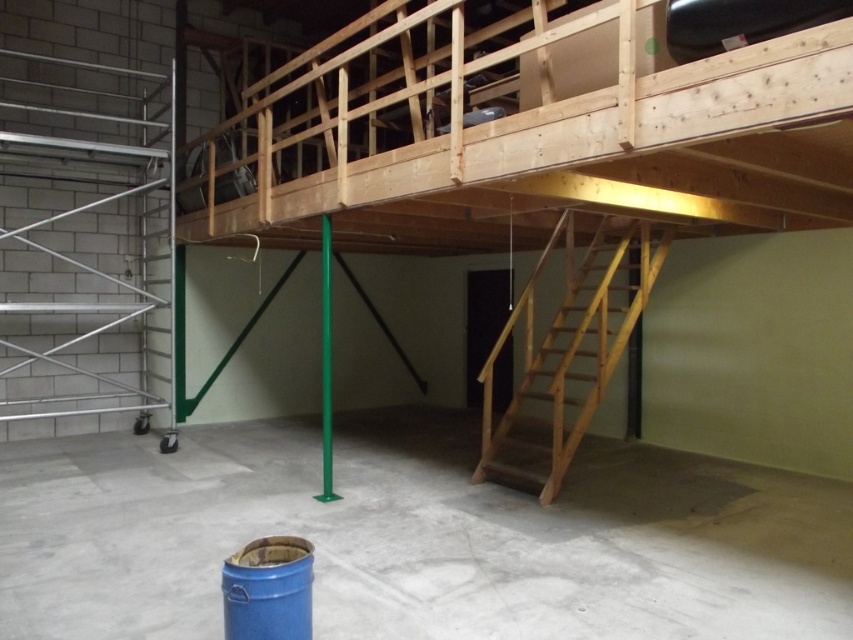
Question: Is blue plastic barrel at lower left in front of natural wood staircase at lower right?

Choices:
 (A) no
 (B) yes

Answer: (B)

Question: Which point is closer to the camera taking this photo?

Choices:
 (A) (604, 378)
 (B) (285, 477)

Answer: (A)

Question: Is blue plastic barrel at lower left wider than natural wood staircase at lower right?

Choices:
 (A) yes
 (B) no

Answer: (A)

Question: Can you confirm if blue plastic barrel at lower left is positioned to the right of natural wood staircase at lower right?

Choices:
 (A) yes
 (B) no

Answer: (A)